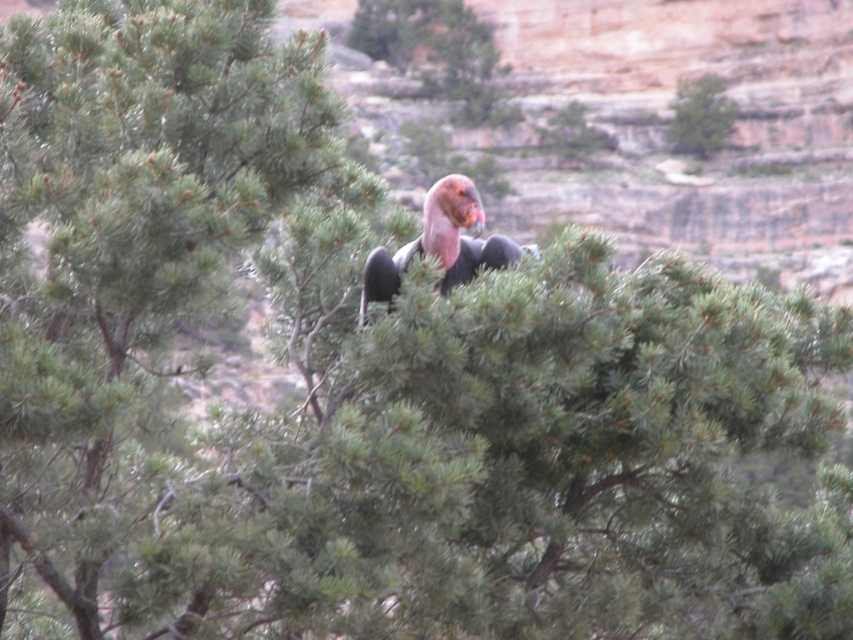
You are a hiker who just arrived at this rocky area. You see a pink feathered bird at center and a green matte tree at upper center. Which object is taller?

The pink feathered bird at center is much taller than the green matte tree at upper center.

You are standing in front of the pine tree and want to locate two specific points marked in the image. Which point, point (471, 259) or point (701, 152), is closer to you?

Point (471, 259) is closer to the viewer than point (701, 152).